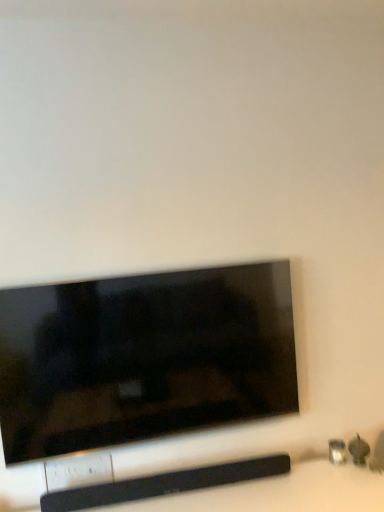
At what (x,y) coordinates should I click in order to perform the action: click on matte black tv at center. Please return your answer as a coordinate pair (x, y). Looking at the image, I should click on [143, 357].

Describe the element at coordinates (143, 357) in the screenshot. The height and width of the screenshot is (512, 384). I see `matte black tv at center` at that location.

Locate an element on the screen. This screenshot has width=384, height=512. matte black tv at center is located at coordinates (143, 357).